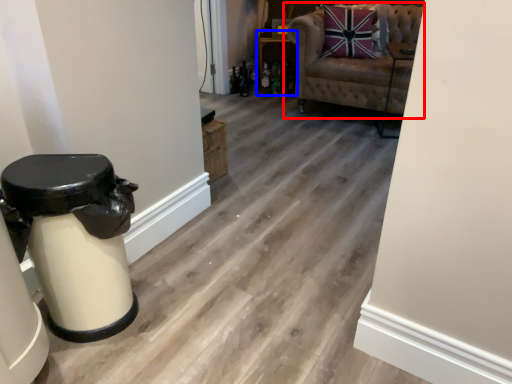
Question: Which object is further to the camera taking this photo, chair (highlighted by a red box) or furniture (highlighted by a blue box)?

Choices:
 (A) chair
 (B) furniture

Answer: (B)